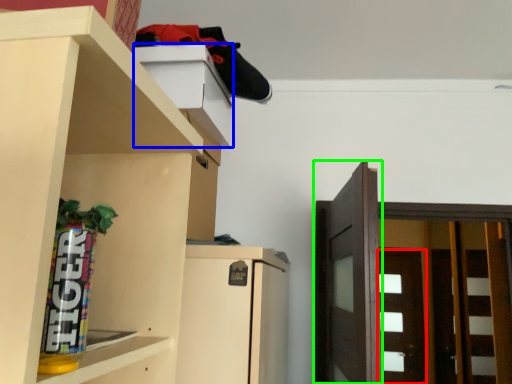
Question: Estimate the real-world distances between objects in this image. Which object is farther from door (highlighted by a red box), cabinet (highlighted by a blue box) or door (highlighted by a green box)?

Choices:
 (A) cabinet
 (B) door

Answer: (A)